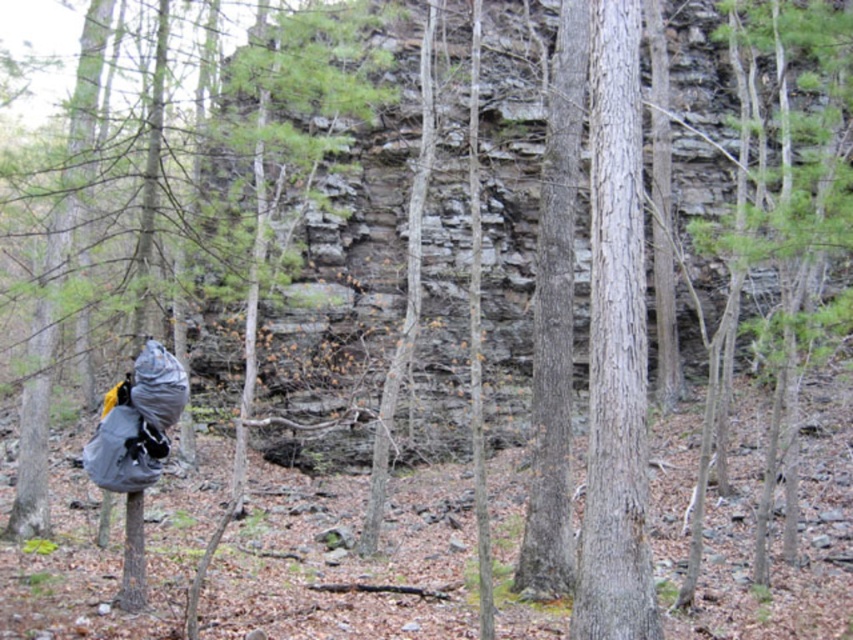
Is gray rough bark tree at center wider than smooth bark tree at center?

Yes, gray rough bark tree at center is wider than smooth bark tree at center.

Is gray rough bark tree at center smaller than smooth bark tree at center?

Incorrect, gray rough bark tree at center is not smaller in size than smooth bark tree at center.

Measure the distance between gray rough bark tree at center and camera.

The distance of gray rough bark tree at center from camera is 10.55 meters.

Locate an element on the screen. This screenshot has height=640, width=853. gray rough bark tree at center is located at coordinates (614, 348).